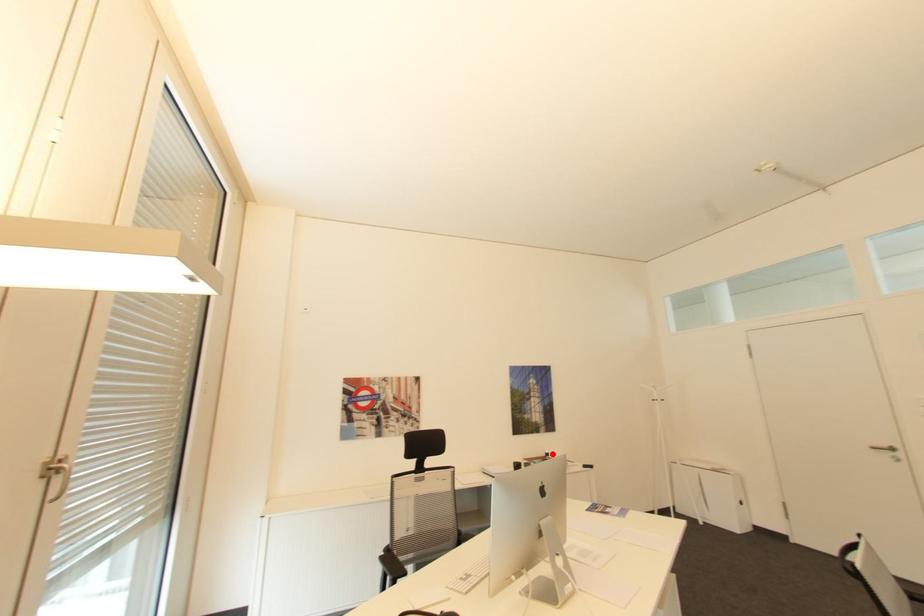
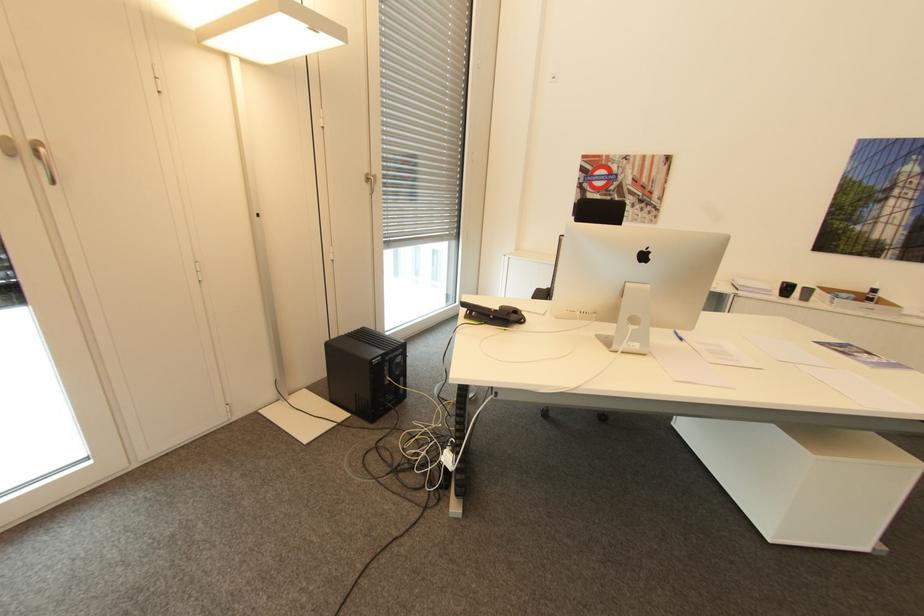
Question: I am providing you with two images of the same scene from different viewpoints. In image1, a red point is highlighted. Considering the same 3D point in image2, which of the following is correct?

Choices:
 (A) It is closer
 (B) It is farther

Answer: (A)